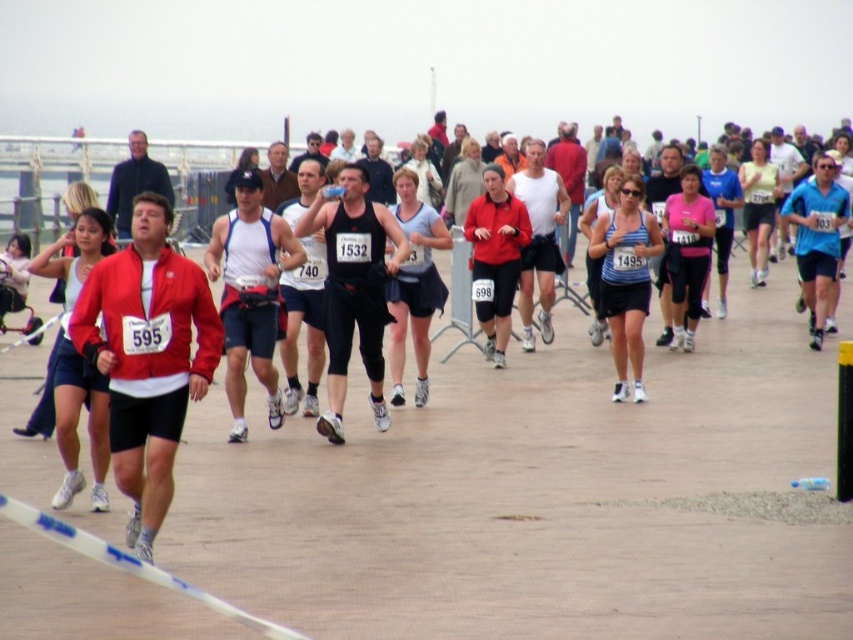
Question: Is blue striped tank top at center wider than matte black shorts at center?

Choices:
 (A) yes
 (B) no

Answer: (A)

Question: Does blue striped tank top at center appear over matte black shorts at center?

Choices:
 (A) no
 (B) yes

Answer: (A)

Question: Which of the following is the farthest from the observer?

Choices:
 (A) (413, 198)
 (B) (635, 368)

Answer: (B)

Question: Is blue striped tank top at center below matte black shorts at center?

Choices:
 (A) no
 (B) yes

Answer: (B)